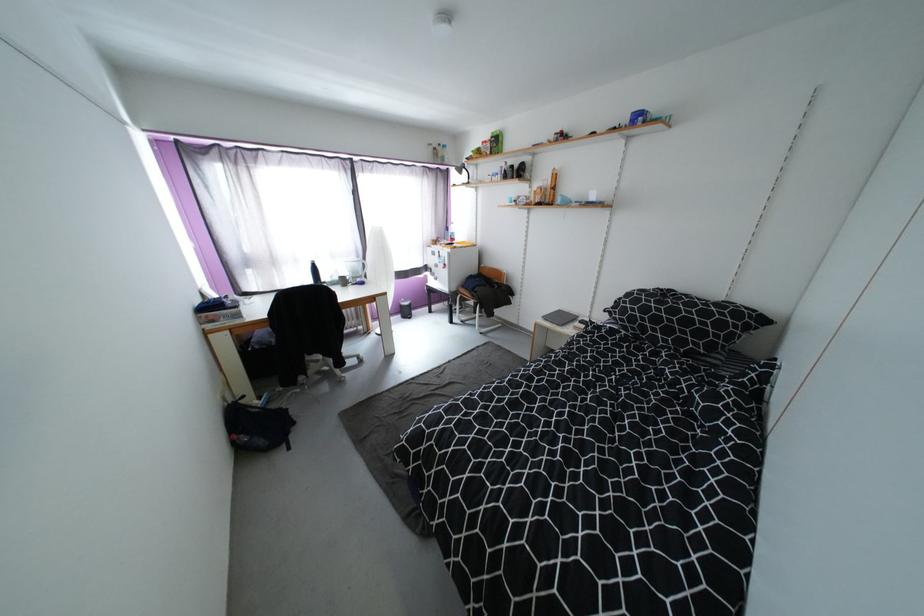
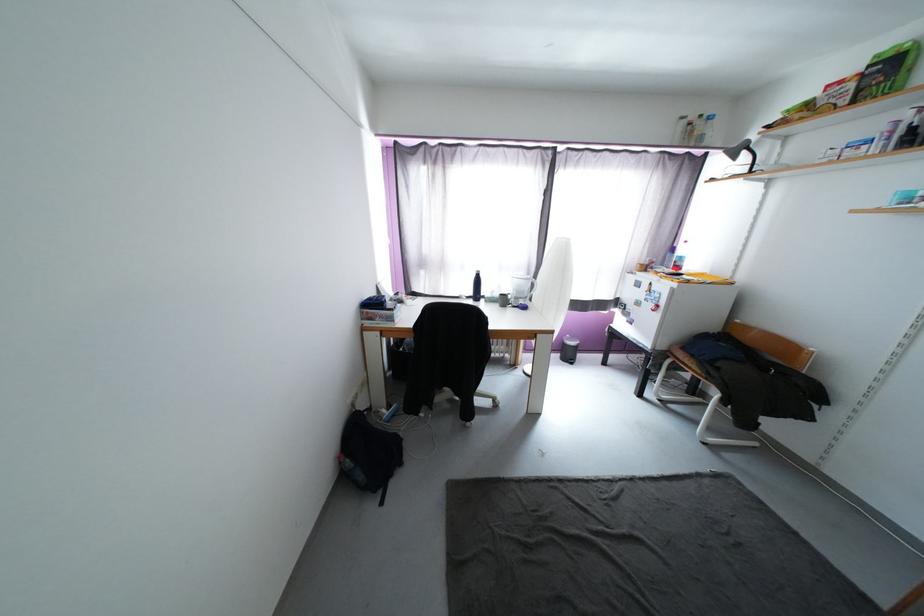
Where in the second image is the point corresponding to the point at 406,317 from the first image?

(564, 357)